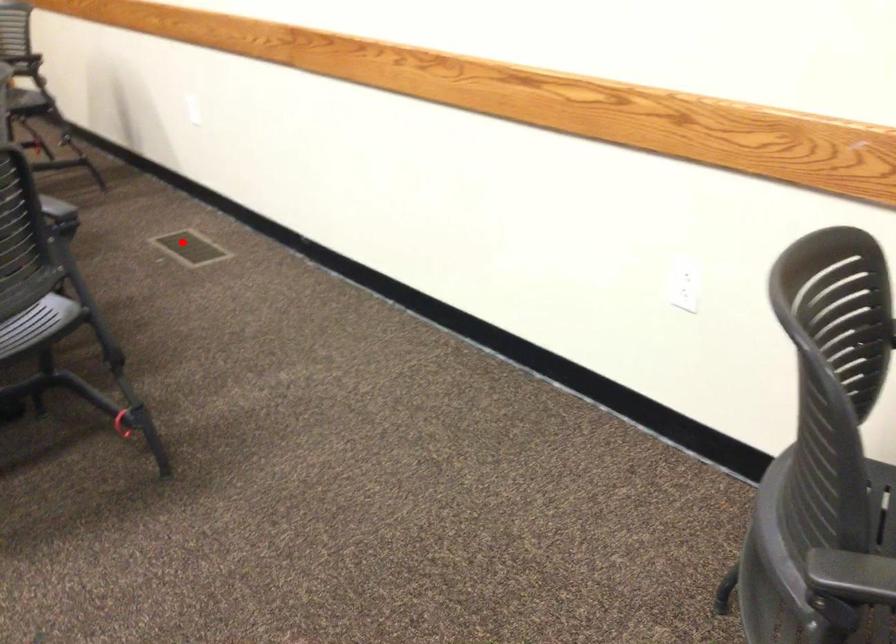
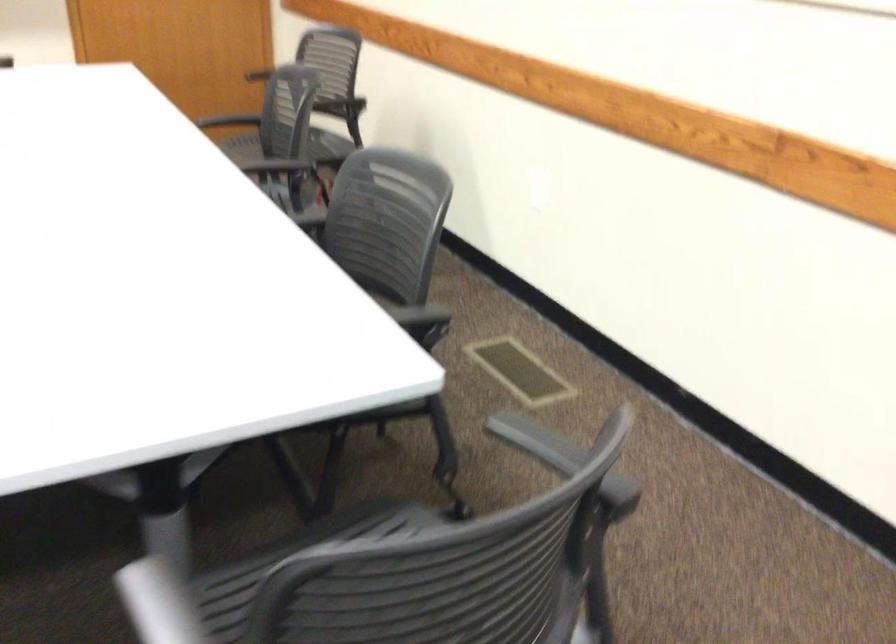
Where in the second image is the point corresponding to the highlighted location from the first image?

(520, 370)